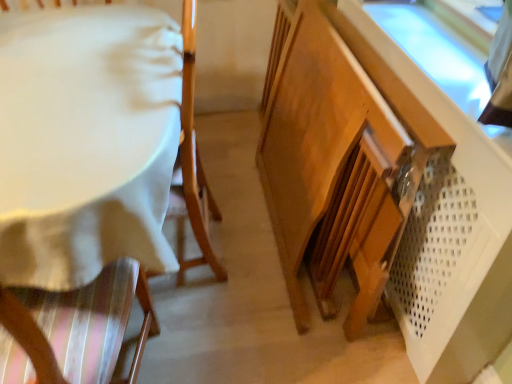
Question: Is white fabric-covered table at left inside the boundaries of wooden cabinet at lower right, or outside?

Choices:
 (A) inside
 (B) outside

Answer: (B)

Question: Considering the positions of white fabric-covered table at left and wooden cabinet at lower right in the image, is white fabric-covered table at left bigger or smaller than wooden cabinet at lower right?

Choices:
 (A) small
 (B) big

Answer: (A)

Question: Is white fabric-covered table at left wider or thinner than wooden cabinet at lower right?

Choices:
 (A) wide
 (B) thin

Answer: (A)

Question: Looking at the image, does wooden cabinet at lower right seem bigger or smaller compared to white fabric-covered table at left?

Choices:
 (A) big
 (B) small

Answer: (A)

Question: From a real-world perspective, is wooden cabinet at lower right physically located above or below white fabric-covered table at left?

Choices:
 (A) above
 (B) below

Answer: (B)

Question: Is wooden cabinet at lower right wider or thinner than white fabric-covered table at left?

Choices:
 (A) thin
 (B) wide

Answer: (A)

Question: From the image's perspective, is wooden cabinet at lower right located above or below white fabric-covered table at left?

Choices:
 (A) below
 (B) above

Answer: (A)